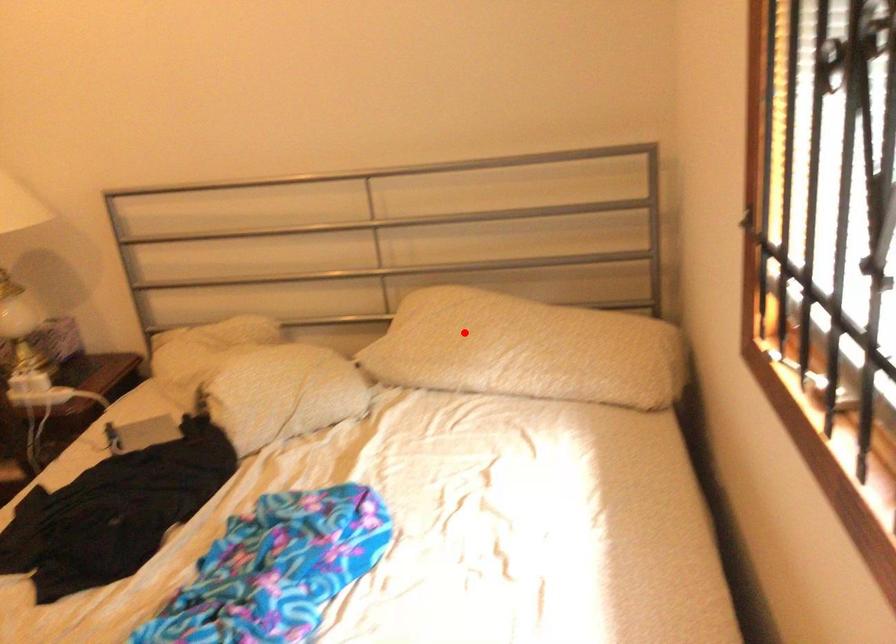
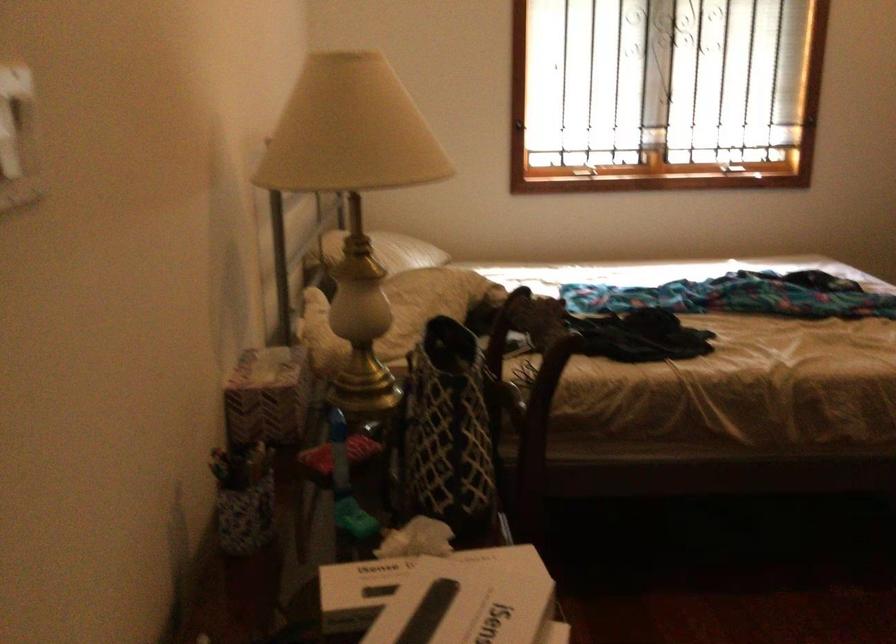
Where in the second image is the point corresponding to the highlighted location from the first image?

(388, 251)